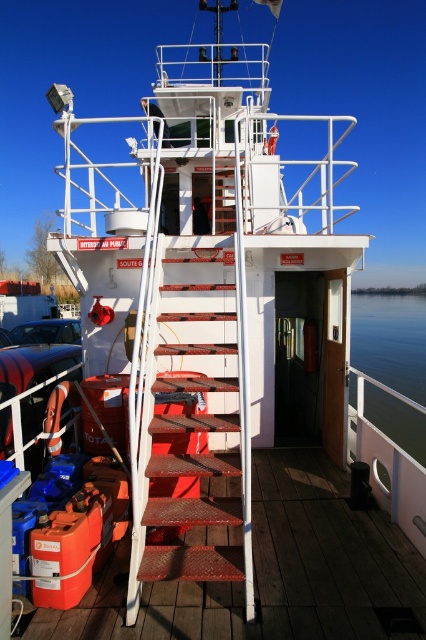
Question: Considering the relative positions of red metal stairs at center and green water at lower right in the image provided, where is red metal stairs at center located with respect to green water at lower right?

Choices:
 (A) right
 (B) left

Answer: (B)

Question: Is red metal stairs at center further to the viewer compared to green water at lower right?

Choices:
 (A) no
 (B) yes

Answer: (A)

Question: Which of the following is the closest to the observer?

Choices:
 (A) green water at lower right
 (B) red metal stairs at center

Answer: (B)

Question: Which point is closer to the camera?

Choices:
 (A) green water at lower right
 (B) red metal stairs at center

Answer: (B)

Question: Which point is farther from the camera taking this photo?

Choices:
 (A) (397, 355)
 (B) (89, 592)

Answer: (A)

Question: Can you confirm if red metal stairs at center is positioned below green water at lower right?

Choices:
 (A) no
 (B) yes

Answer: (B)